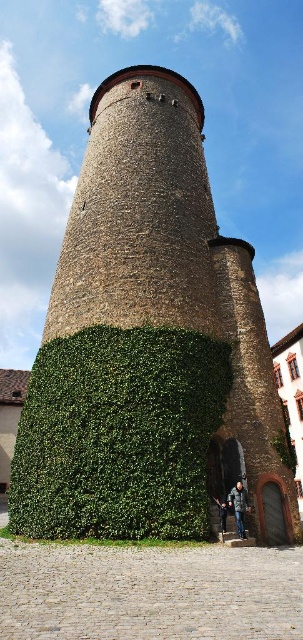
Where is `green ivy-covered tower at center`? This screenshot has height=640, width=303. green ivy-covered tower at center is located at coordinates (147, 340).

Can you confirm if green ivy-covered tower at center is positioned above green leafy hedge at center?

Yes.

Measure the distance between green ivy-covered tower at center and camera.

green ivy-covered tower at center and camera are 98.67 feet apart from each other.

At what (x,y) coordinates should I click in order to perform the action: click on green ivy-covered tower at center. Please return your answer as a coordinate pair (x, y). The width and height of the screenshot is (303, 640). Looking at the image, I should click on (147, 340).